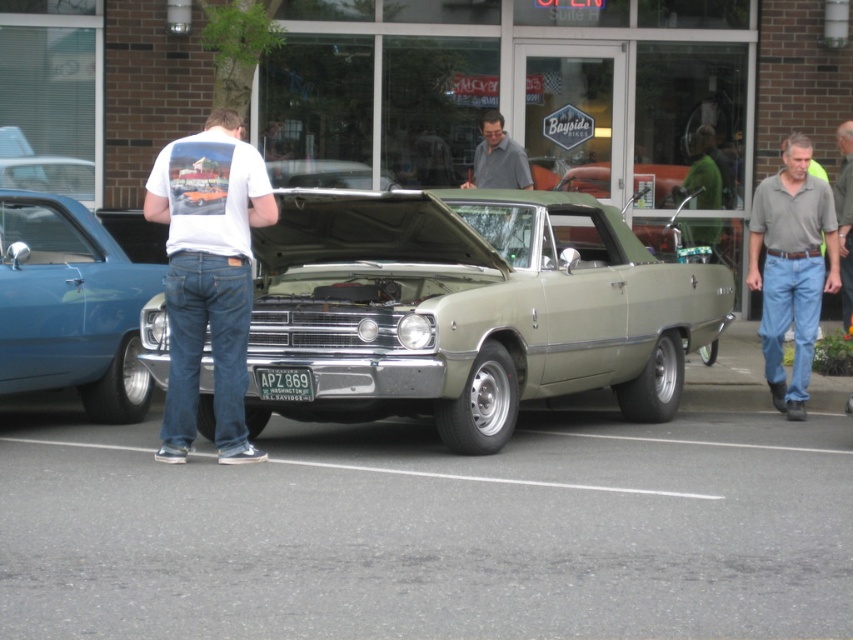
Question: Can you confirm if light green metallic car at center is positioned to the left of shiny blue car at left?

Choices:
 (A) no
 (B) yes

Answer: (A)

Question: Does gray cotton shirt at right appear on the right side of gray fabric shirt at right?

Choices:
 (A) yes
 (B) no

Answer: (B)

Question: Is white cotton t-shirt at center below green metallic license plate at center?

Choices:
 (A) no
 (B) yes

Answer: (A)

Question: Which is nearer to the green metallic license plate at center?

Choices:
 (A) light green metallic car at center
 (B) shiny blue car at left
 (C) gray cotton shirt at right
 (D) white cotton t-shirt at center

Answer: (D)

Question: Among these objects, which one is nearest to the camera?

Choices:
 (A) light green metallic car at center
 (B) gray fabric shirt at right
 (C) white cotton t-shirt at center
 (D) gray cotton shirt at right

Answer: (C)

Question: Estimate the real-world distances between objects in this image. Which object is closer to the gray fabric shirt at center?

Choices:
 (A) light green metallic car at center
 (B) gray fabric shirt at right
 (C) green metallic license plate at center

Answer: (A)